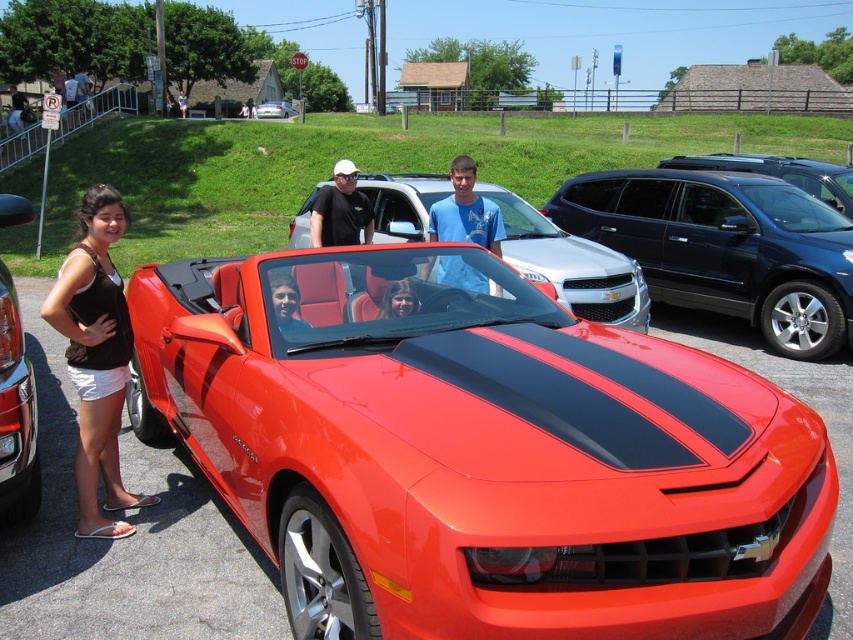
You are a photographer trying to capture a clear shot of the shiny orange convertible at center and the smooth skin face at center. Which object is closer to the camera?

The smooth skin face at center is closer to the camera than the shiny orange convertible at center because the shiny orange convertible at center is positioned under the smooth skin face at center.

You are a photographer at the car show. You need to adjust the lighting so that the matte black tank top at left and the shiny red convertible at center are equally visible. Which object requires more light adjustment?

The matte black tank top at left requires more light adjustment because it has a greater height compared to the shiny red convertible at center, making it more prominent and needing balanced lighting.

You are a photographer standing next to the camera. You want to take a photo of the shiny orange convertible at center. Is the distance between you and the car sufficient to capture the entire vehicle in the frame without moving closer?

The distance between the shiny orange convertible at center and the camera is 6.73 feet. Since the photographer is standing next to the camera, this distance should be sufficient to capture the entire vehicle in the frame without needing to move closer, assuming the camera has a wide enough lens.